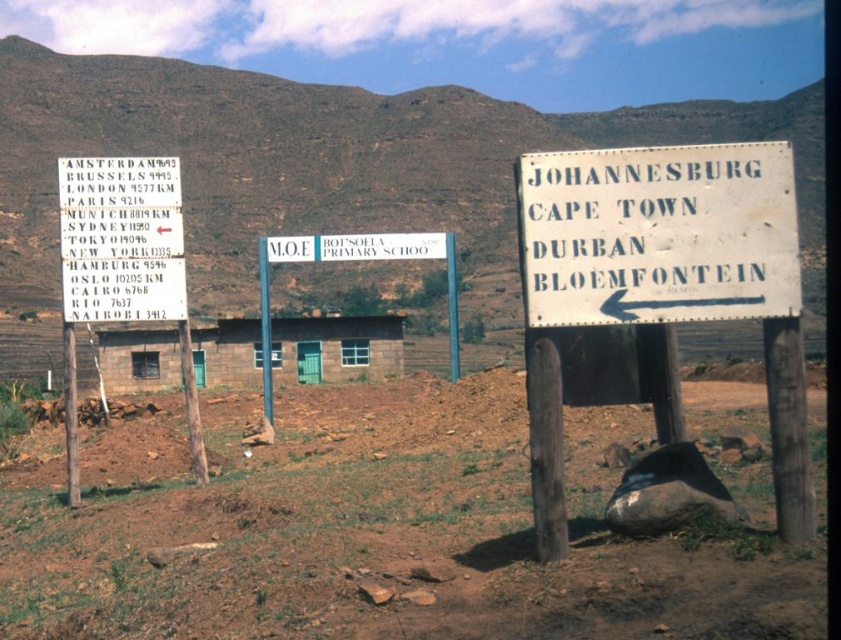
Question: Which point appears farthest from the camera in this image?

Choices:
 (A) (272, 364)
 (B) (115, 296)
 (C) (104, 529)

Answer: (A)

Question: Does brown soil at center have a smaller size compared to white painted wood sign at right?

Choices:
 (A) yes
 (B) no

Answer: (B)

Question: Which object is positioned closest to the white paper sign at upper left?

Choices:
 (A) white painted wood sign at right
 (B) brown soil at center
 (C) white wooden sign at center

Answer: (B)

Question: Does white painted wood sign at right lie in front of white wooden sign at center?

Choices:
 (A) yes
 (B) no

Answer: (A)

Question: Estimate the real-world distances between objects in this image. Which object is farther from the white paper sign at upper left?

Choices:
 (A) white wooden sign at center
 (B) brown soil at center

Answer: (A)

Question: Can you confirm if brown soil at center is wider than white painted wood sign at right?

Choices:
 (A) yes
 (B) no

Answer: (A)